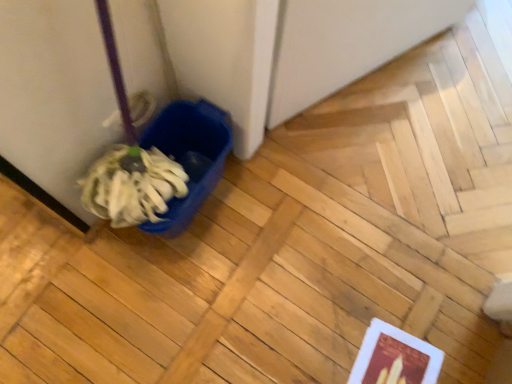
Image resolution: width=512 pixels, height=384 pixels. Describe the element at coordinates (141, 107) in the screenshot. I see `white fabric mop head at lower left` at that location.

Find the location of a particular element. This screenshot has height=384, width=512. white fabric mop head at lower left is located at coordinates (141, 107).

At what (x,y) coordinates should I click in order to perform the action: click on white fabric mop head at lower left. Please return your answer as a coordinate pair (x, y). The height and width of the screenshot is (384, 512). Looking at the image, I should click on (141, 107).